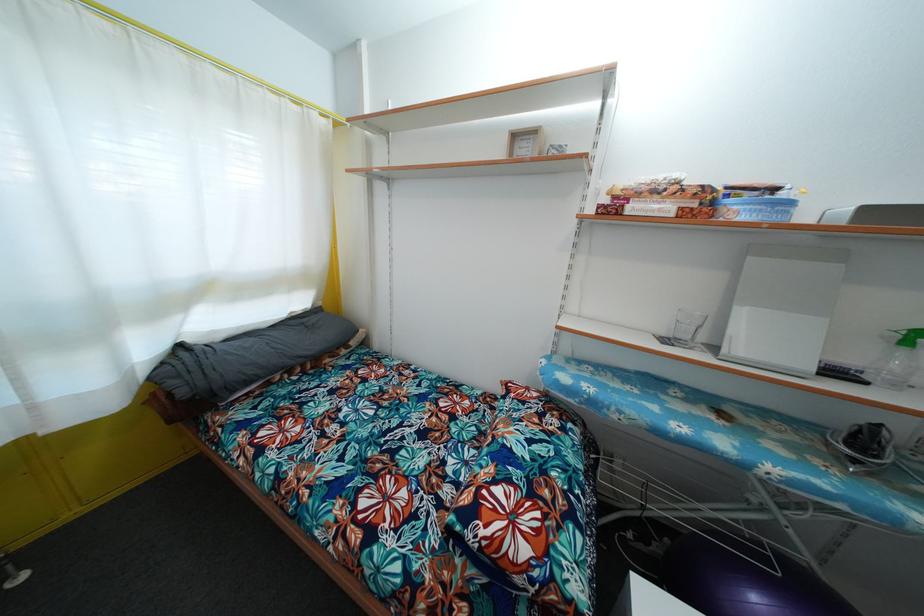
Describe the element at coordinates (525, 142) in the screenshot. Image resolution: width=924 pixels, height=616 pixels. I see `the small framed picture` at that location.